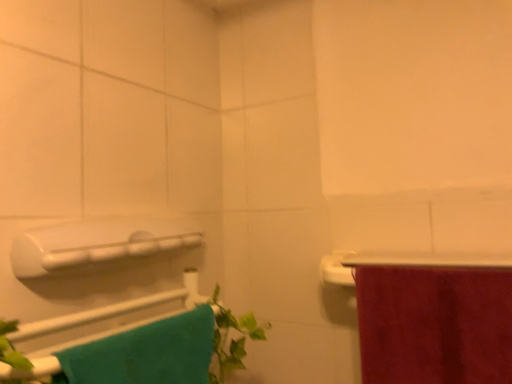
In order to click on teal felt towel at lower left in this screenshot , I will do `click(146, 353)`.

This screenshot has width=512, height=384. What do you see at coordinates (146, 353) in the screenshot? I see `teal felt towel at lower left` at bounding box center [146, 353].

Image resolution: width=512 pixels, height=384 pixels. Identify the location of teal felt towel at lower left. (146, 353).